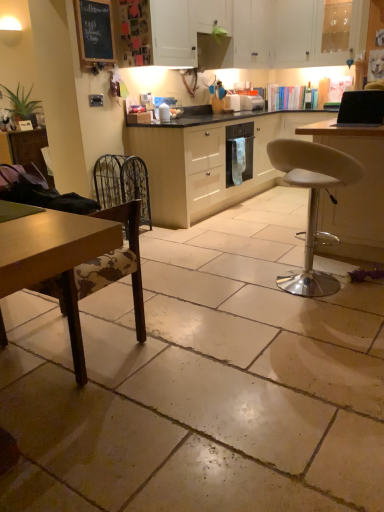
Question: From a real-world perspective, is black glossy laptop at upper right physically below white matte cabinet at upper center, placed as the second cabinetry when sorted from bottom to top?

Choices:
 (A) no
 (B) yes

Answer: (B)

Question: Does black glossy laptop at upper right appear on the left side of white matte cabinet at upper center, which is the 2th cabinetry in top-to-bottom order?

Choices:
 (A) no
 (B) yes

Answer: (A)

Question: Is black glossy laptop at upper right shorter than white matte cabinet at upper center, which is the 2th cabinetry in top-to-bottom order?

Choices:
 (A) yes
 (B) no

Answer: (A)

Question: Does black glossy laptop at upper right touch white matte cabinet at upper center, placed as the second cabinetry when sorted from bottom to top?

Choices:
 (A) yes
 (B) no

Answer: (B)

Question: From a real-world perspective, is black glossy laptop at upper right positioned over white matte cabinet at upper center, which is the 2th cabinetry in top-to-bottom order, based on gravity?

Choices:
 (A) yes
 (B) no

Answer: (B)

Question: Is there a large distance between black glossy laptop at upper right and white matte cabinet at upper center, placed as the second cabinetry when sorted from bottom to top?

Choices:
 (A) yes
 (B) no

Answer: (A)

Question: Does metallic wire swivel chair at left lie in front of metallic oven at center, the second appliance from the front?

Choices:
 (A) no
 (B) yes

Answer: (B)

Question: Is metallic wire swivel chair at left looking in the opposite direction of metallic oven at center, arranged as the 1th appliance when viewed from the back?

Choices:
 (A) no
 (B) yes

Answer: (A)

Question: Is metallic wire swivel chair at left completely or partially outside of metallic oven at center, the second appliance from the front?

Choices:
 (A) no
 (B) yes

Answer: (B)

Question: Is metallic oven at center, arranged as the 1th appliance when viewed from the back, located within metallic wire swivel chair at left?

Choices:
 (A) yes
 (B) no

Answer: (B)

Question: Does metallic wire swivel chair at left appear on the right side of metallic oven at center, arranged as the 1th appliance when viewed from the back?

Choices:
 (A) yes
 (B) no

Answer: (B)

Question: From a real-world perspective, is metallic wire swivel chair at left over metallic oven at center, the second appliance from the front?

Choices:
 (A) yes
 (B) no

Answer: (B)

Question: Is metallic oven at center, arranged as the 1th appliance when viewed from the back, completely or partially inside black glossy laptop at upper right?

Choices:
 (A) no
 (B) yes

Answer: (A)